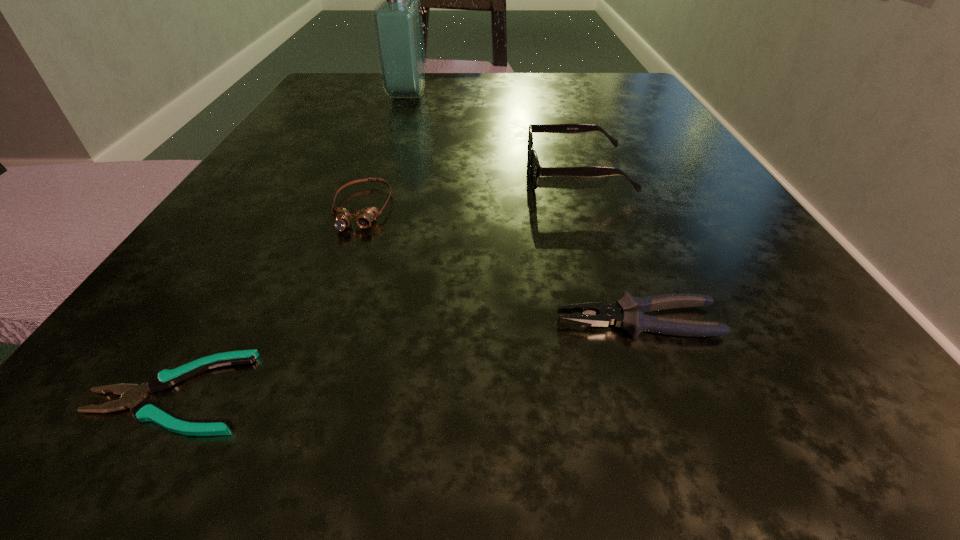
The width and height of the screenshot is (960, 540). What are the coordinates of `perfume` in the screenshot? It's located at (397, 20).

The image size is (960, 540). Identify the location of the tallest object. (397, 20).

In order to click on the second tallest object in this screenshot , I will do `click(536, 170)`.

Image resolution: width=960 pixels, height=540 pixels. Find the location of `goggles`. goggles is located at coordinates (364, 217).

The image size is (960, 540). In order to click on the taller pliers in this screenshot , I will do `click(628, 312)`.

Where is `the second nearest object`? the second nearest object is located at coordinates (628, 312).

What are the coordinates of `the leftmost object` in the screenshot? It's located at (144, 410).

At what (x,y) coordinates should I click in order to perform the action: click on the nearest object. Please return your answer as a coordinate pair (x, y). Looking at the image, I should click on (144, 410).

The image size is (960, 540). I want to click on vacant space located 0.170m on the front label of the tallest object, so [515, 95].

The image size is (960, 540). In order to click on vacant space located 0.230m at the front lenses of the sunglasses in this screenshot , I will do pyautogui.click(x=365, y=173).